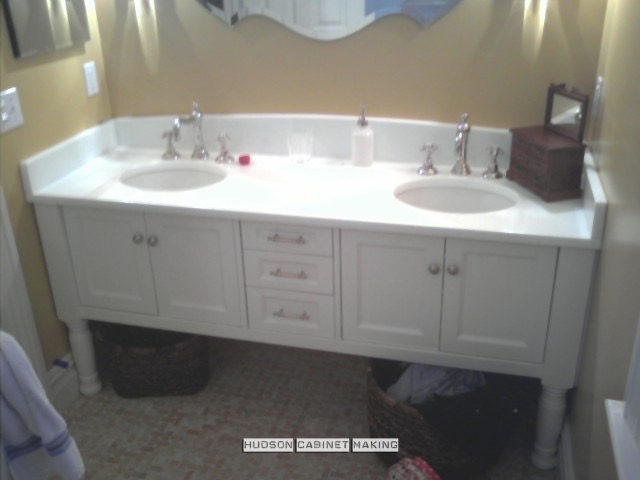
Identify the location of mirror. The image size is (640, 480). (314, 14).